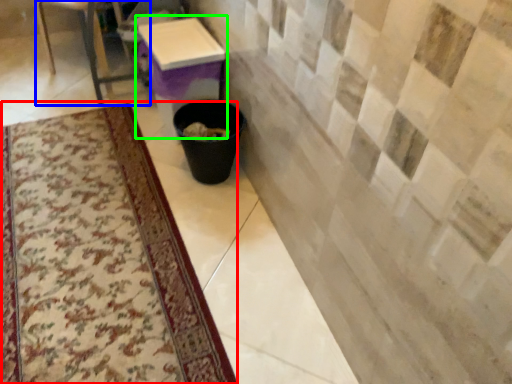
Question: Which object is the closest to the mat (highlighted by a red box)? Choose among these: furniture (highlighted by a blue box) or table (highlighted by a green box).

Choices:
 (A) furniture
 (B) table

Answer: (B)